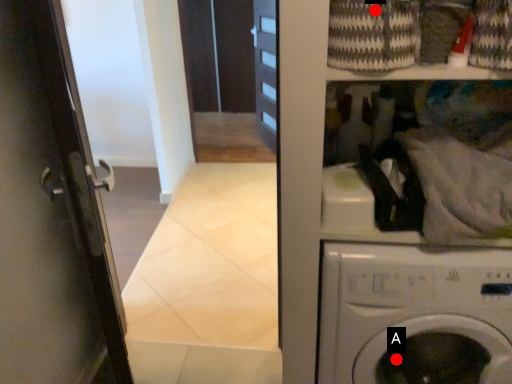
Question: Two points are circled on the image, labeled by A and B beside each circle. Which point appears closest to the camera in this image?

Choices:
 (A) A is closer
 (B) B is closer

Answer: (B)